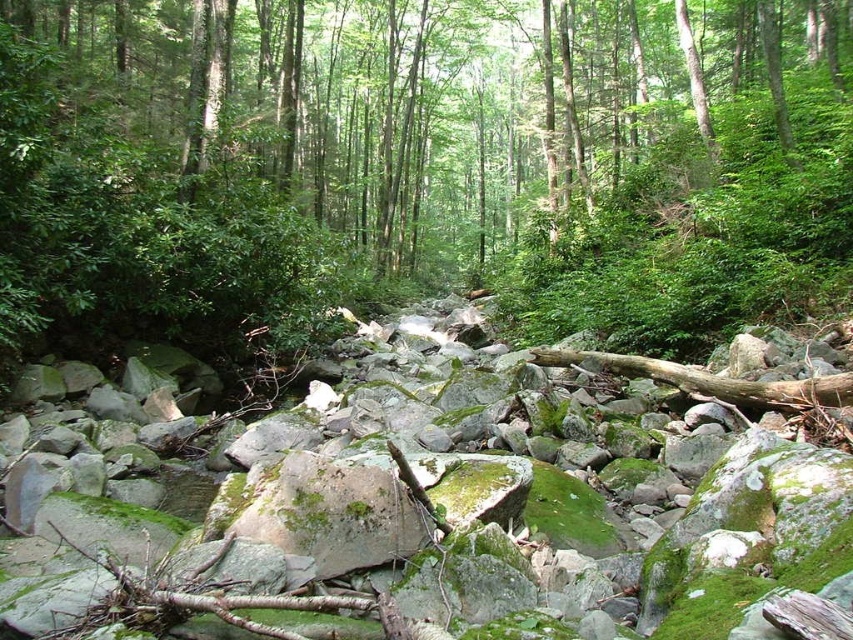
You are a hiker trying to navigate through the forest. You need to step on the green mossy rock at center to avoid getting your shoes dirty. What are the exact coordinates where you should place your foot to step on it?

The green mossy rock at center is located at coordinates 0.231 on the x axis and 0.525 on the y axis, so you should place your foot at those coordinates to step on it.

Looking at this image, you are navigating through the forest and come across two points marked on your map. The first point is labeled as point (90,6) and the second is point (219,506). From your current position, which point is farther away from you?

Point (90,6) is behind point (219,506), so it is farther away from your current position.